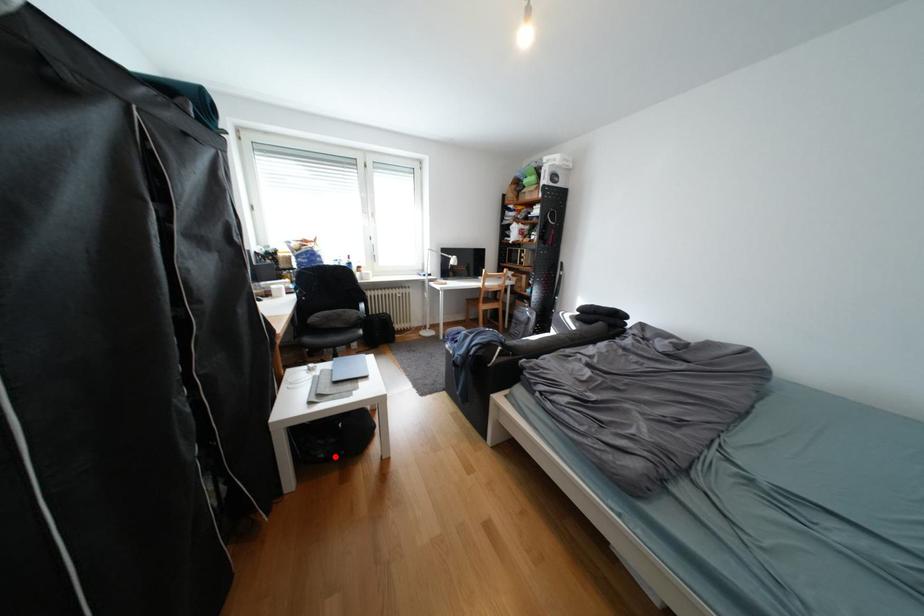
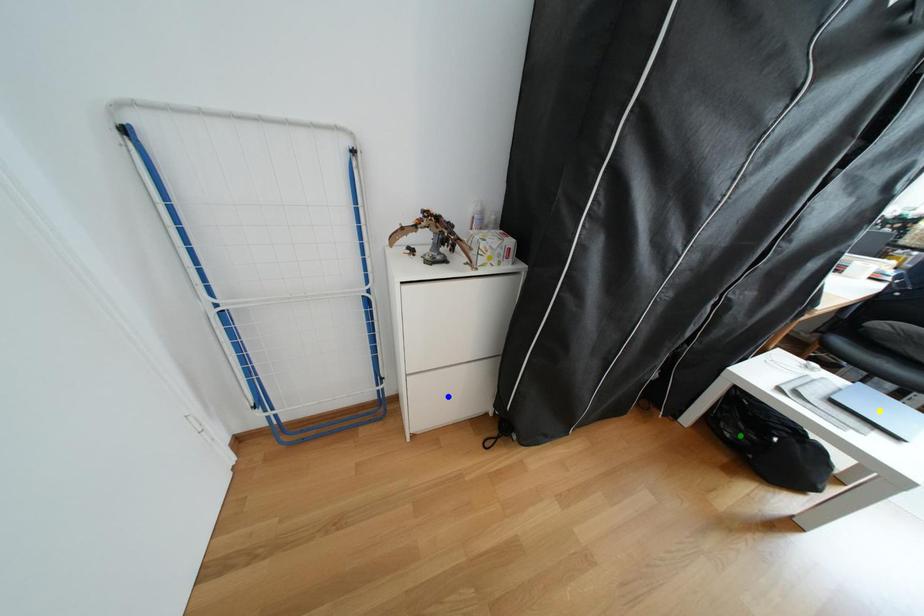
Question: I am providing you with two images of the same scene from different viewpoints. A red point is marked on the first image. You are given multiple points on the second image. Which point in image 2 represents the same 3d spot as the red point in image 1?

Choices:
 (A) blue point
 (B) yellow point
 (C) green point

Answer: (C)